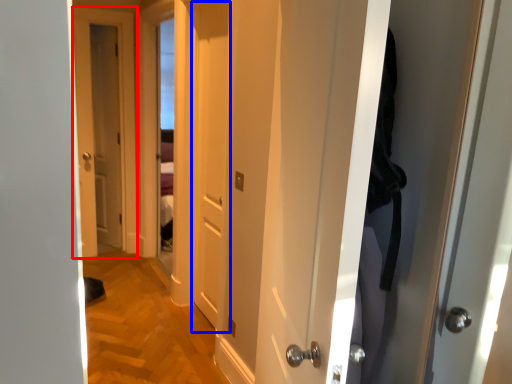
Question: Among these objects, which one is nearest to the camera, door (highlighted by a red box) or door (highlighted by a blue box)?

Choices:
 (A) door
 (B) door

Answer: (B)